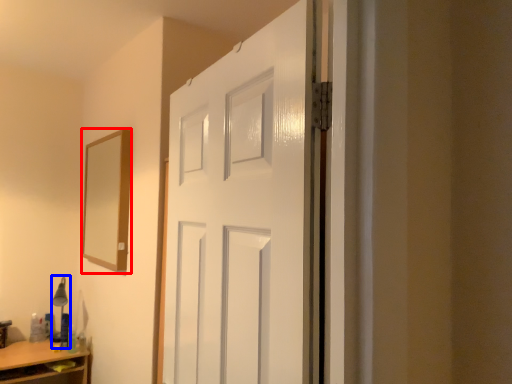
Question: Which point is closer to the camera, mirror (highlighted by a red box) or table lamp (highlighted by a blue box)?

Choices:
 (A) mirror
 (B) table lamp

Answer: (A)